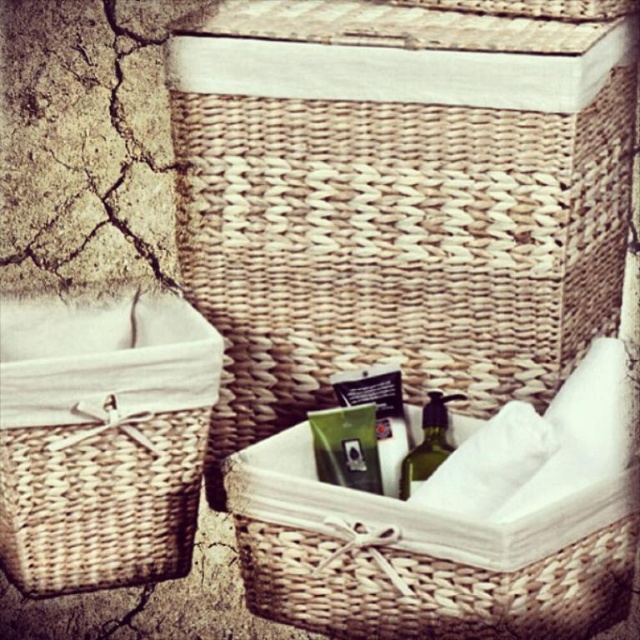
Describe the element at coordinates (100, 440) in the screenshot. I see `natural woven picnic basket at left` at that location.

Is natural woven picnic basket at left above woven beige basket at center?

Correct, natural woven picnic basket at left is located above woven beige basket at center.

Is point (35, 301) closer to camera compared to point (420, 618)?

No.

At what (x,y) coordinates should I click in order to perform the action: click on natural woven picnic basket at left. Please return your answer as a coordinate pair (x, y). Looking at the image, I should click on (100, 440).

Who is positioned more to the left, woven natural picnic basket at upper center or woven beige basket at center?

woven natural picnic basket at upper center is more to the left.

How distant is woven natural picnic basket at upper center from woven beige basket at center?

A distance of 8.71 inches exists between woven natural picnic basket at upper center and woven beige basket at center.

Who is more forward, (536, 93) or (259, 499)?

Point (259, 499) is more forward.

Identify the location of woven natural picnic basket at upper center. The width and height of the screenshot is (640, 640). (397, 198).

What do you see at coordinates (100, 440) in the screenshot? I see `natural woven picnic basket at left` at bounding box center [100, 440].

Does natural woven picnic basket at left have a greater width compared to matte green plastic card at center?

Yes.

Locate an element on the screen. natural woven picnic basket at left is located at coordinates (100, 440).

Where is `natural woven picnic basket at left`? natural woven picnic basket at left is located at coordinates (100, 440).